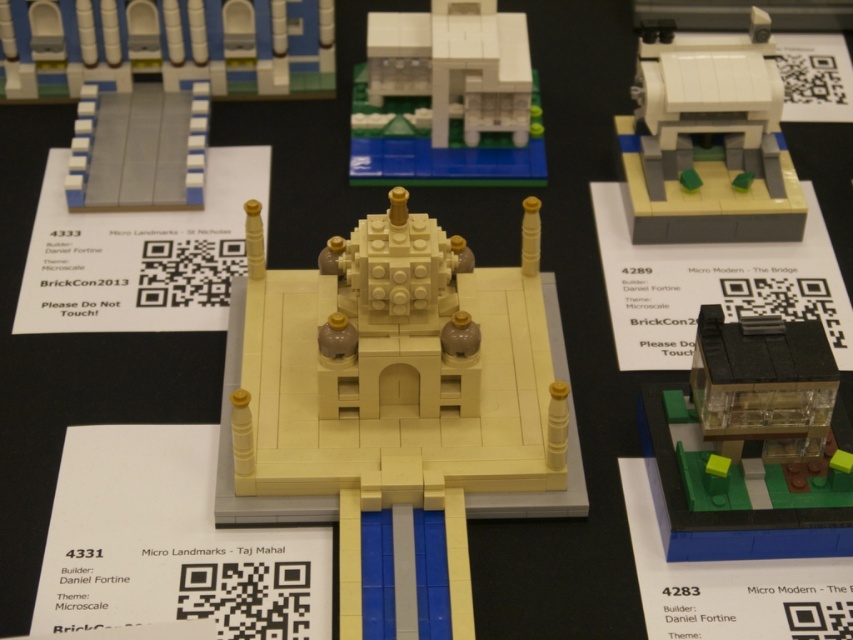
Which is in front, point (751, 332) or point (717, 200)?

Point (751, 332) is more forward.

How far apart are transparent plastic house at lower right and white matte house at upper right?

A distance of 40.44 centimeters exists between transparent plastic house at lower right and white matte house at upper right.

Locate an element on the screen. transparent plastic house at lower right is located at coordinates (752, 444).

Is transparent plastic house at lower right positioned at the back of smooth gray tiles at upper left?

No, transparent plastic house at lower right is in front of smooth gray tiles at upper left.

Who is positioned more to the right, transparent plastic house at lower right or smooth gray tiles at upper left?

From the viewer's perspective, transparent plastic house at lower right appears more on the right side.

Image resolution: width=853 pixels, height=640 pixels. What are the coordinates of `transparent plastic house at lower right` in the screenshot? It's located at (752, 444).

Is beige matte taj mahal at center closer to the viewer compared to transparent plastic house at lower right?

Yes, it is.

Between beige matte taj mahal at center and transparent plastic house at lower right, which one is positioned higher?

beige matte taj mahal at center is higher up.

Image resolution: width=853 pixels, height=640 pixels. I want to click on beige matte taj mahal at center, so click(x=393, y=404).

Identify the location of beige matte taj mahal at center. Image resolution: width=853 pixels, height=640 pixels. (393, 404).